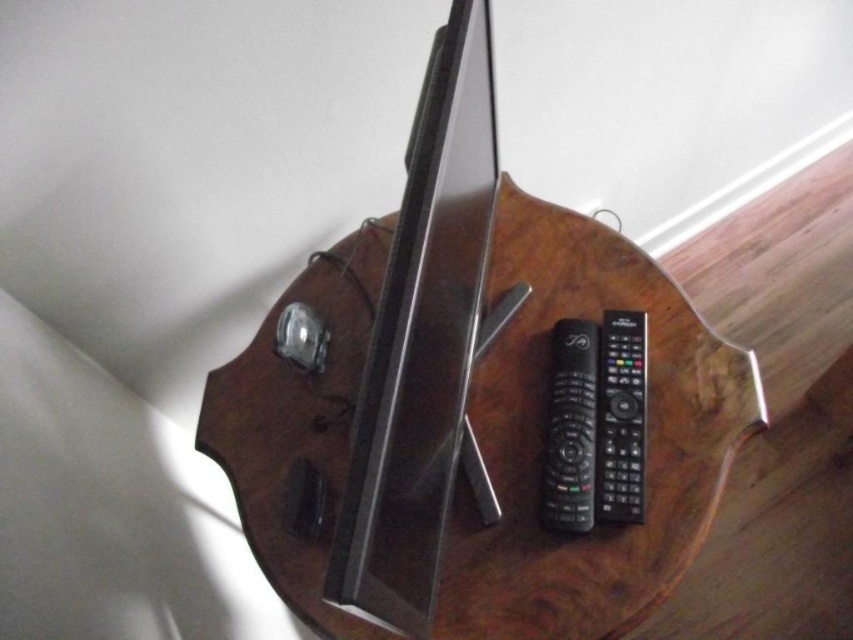
You are trying to choose a remote control to operate the TV. The black plastic remote at center and the black plastic remote at right are both on the table. Which remote control is bigger in size?

The black plastic remote at center is larger in size compared to the black plastic remote at right.

You are organizing the items on the wooden table at center. You want to place the black plastic remote at center closer to the edge of the table. Which direction should you move it to achieve this?

Since the wooden table at center is to the left of the black plastic remote at center, moving the black plastic remote at center to the right would bring it closer to the edge of the table.